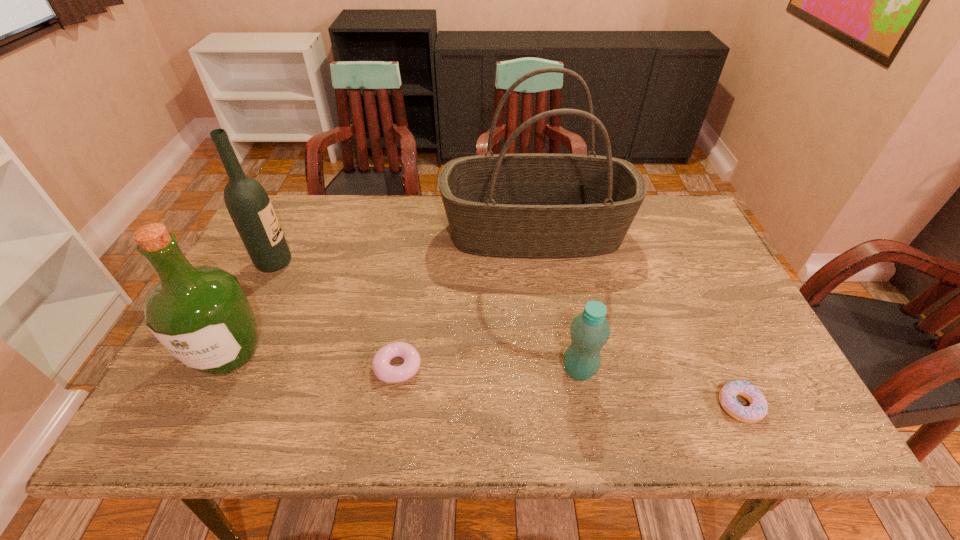
Image resolution: width=960 pixels, height=540 pixels. What are the coordinates of `vacant region between the wine bottle and the basket` in the screenshot? It's located at (405, 248).

Locate an element on the screen. The image size is (960, 540). free space between the water bottle and the basket is located at coordinates (558, 301).

Where is `vacant area between the wine bottle and the basket`? vacant area between the wine bottle and the basket is located at coordinates (405, 248).

Locate an element on the screen. The image size is (960, 540). vacant space that's between the rightmost object and the basket is located at coordinates (637, 319).

This screenshot has height=540, width=960. Find the location of `vacant space that's between the right doughnut and the wine bottle`. vacant space that's between the right doughnut and the wine bottle is located at coordinates (507, 334).

This screenshot has height=540, width=960. In order to click on the second closest object to the water bottle in this screenshot , I will do `click(529, 205)`.

Locate which object ranks fifth in proximity to the third shortest object. Please provide its 2D coordinates. Your answer should be formatted as a tuple, i.e. [(x, y)], where the tuple contains the x and y coordinates of a point satisfying the conditions above.

[(247, 202)]

You are a GUI agent. You are given a task and a screenshot of the screen. Output one action in this format:
    pyautogui.click(x=<x>, y=<y>)
    Task: Click on the vacant space that satisfies the following two spatial constraints: 1. on the back side of the rightmost object; 2. at the front cap of the water bottle
    The image size is (960, 540).
    Given the screenshot: What is the action you would take?
    pyautogui.click(x=723, y=370)

In order to click on vacant area in the image that satisfies the following two spatial constraints: 1. on the front-facing side of the liquor; 2. on the right side of the rightmost object in this screenshot , I will do `click(204, 405)`.

The width and height of the screenshot is (960, 540). Find the location of `vacant point that satisfies the following two spatial constraints: 1. on the labeled side of the wine bottle; 2. on the front-facing side of the liquor`. vacant point that satisfies the following two spatial constraints: 1. on the labeled side of the wine bottle; 2. on the front-facing side of the liquor is located at coordinates (231, 353).